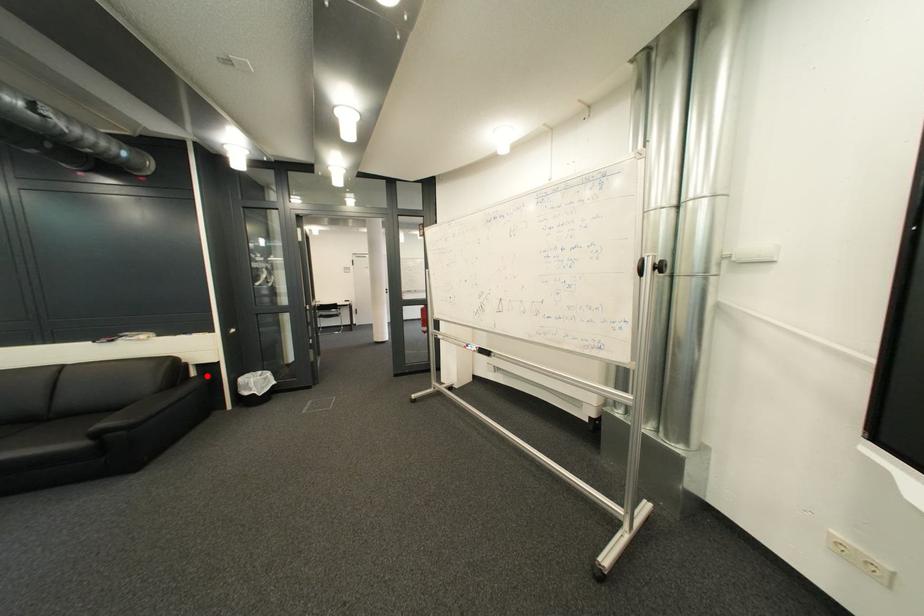
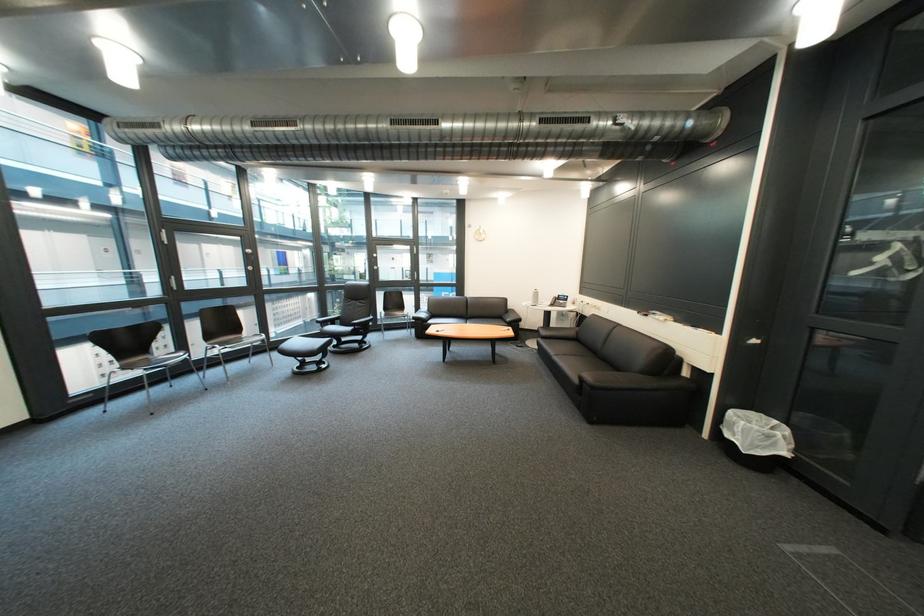
The point at the highlighted location is marked in the first image. Where is the corresponding point in the second image?

(699, 375)